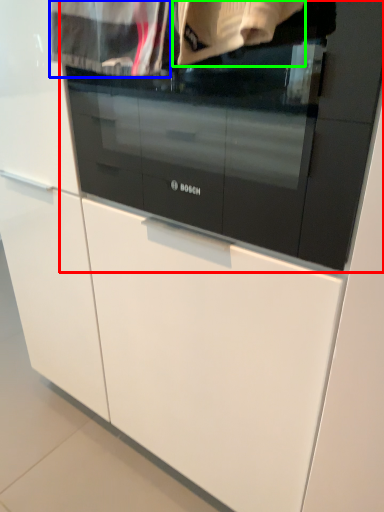
Question: Estimate the real-world distances between objects in this image. Which object is farther from oven (highlighted by a red box), clothing (highlighted by a blue box) or clothing (highlighted by a green box)?

Choices:
 (A) clothing
 (B) clothing

Answer: (A)